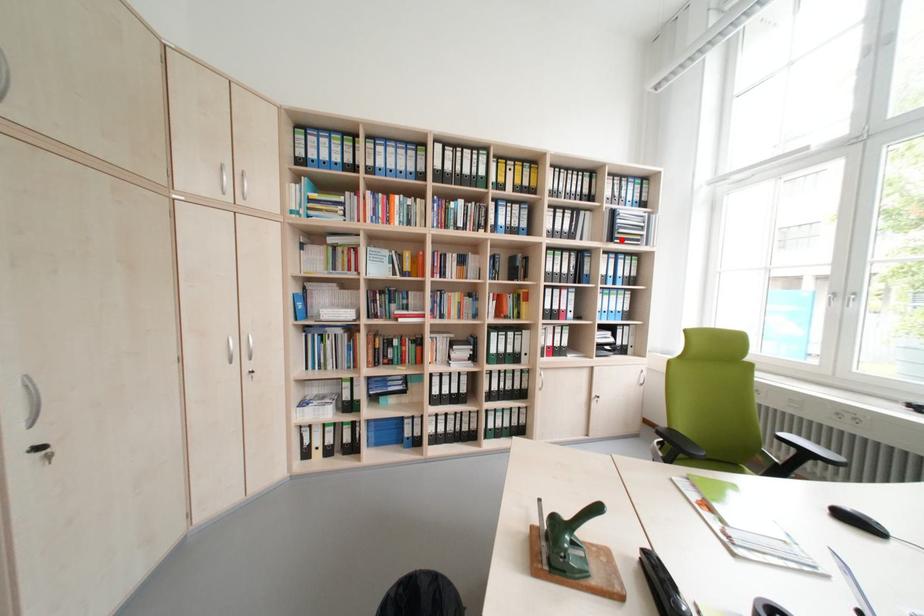
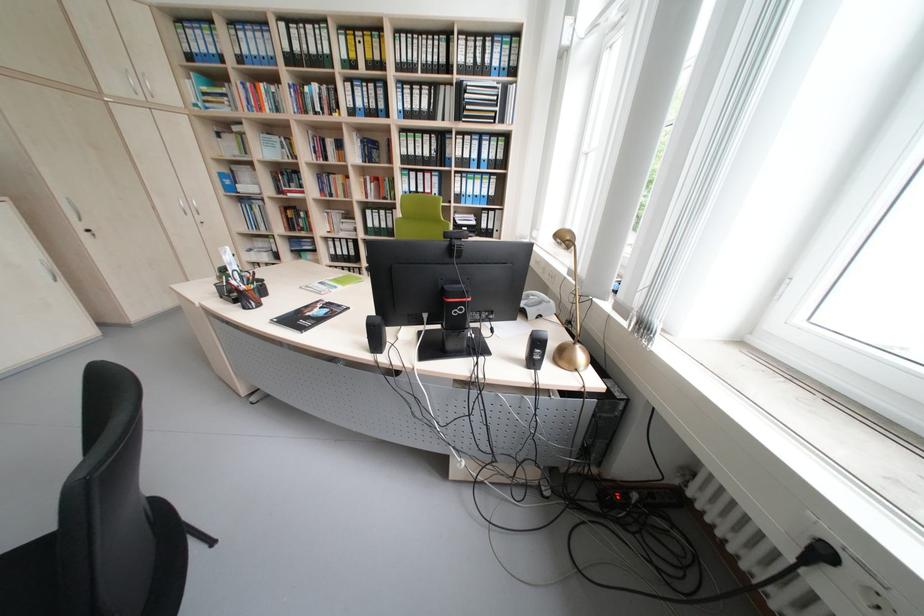
Where in the second image is the point corresponding to the highlighted location from the first image?

(468, 119)